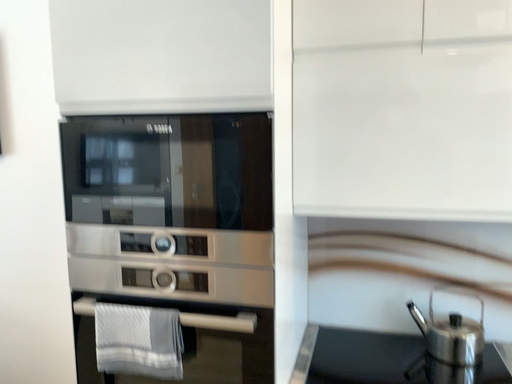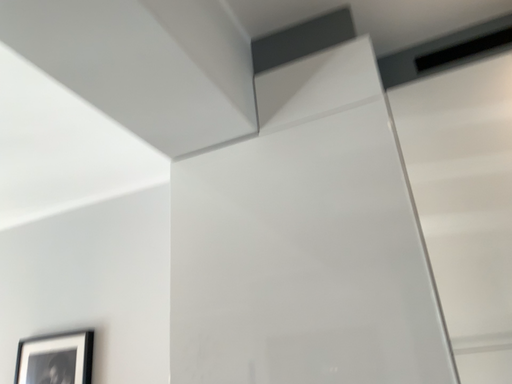
Question: Which way did the camera rotate in the video?

Choices:
 (A) rotated right
 (B) rotated left

Answer: (B)